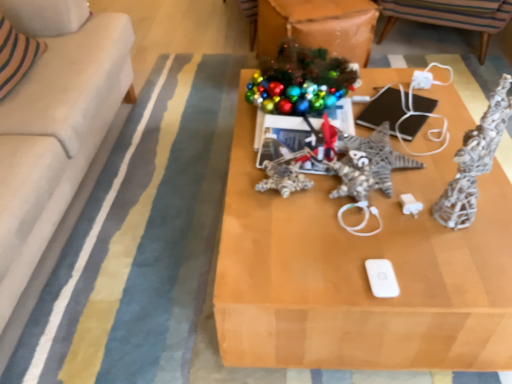
Where is `free space to the back side of white matte ipod at center`? The image size is (512, 384). free space to the back side of white matte ipod at center is located at coordinates pos(360,227).